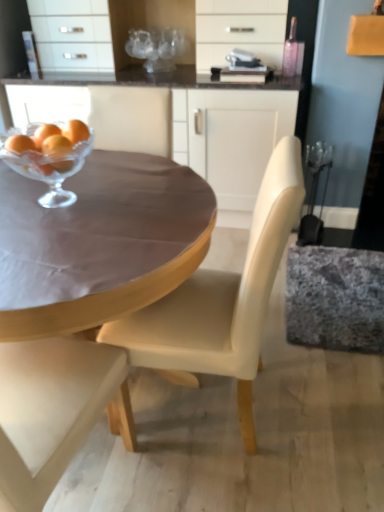
Question: Is matte white cabinet at upper center facing away from translucent glass tangerine at upper left?

Choices:
 (A) no
 (B) yes

Answer: (A)

Question: Considering the relative positions of matte white cabinet at upper center and translucent glass tangerine at upper left in the image provided, is matte white cabinet at upper center to the left of translucent glass tangerine at upper left from the viewer's perspective?

Choices:
 (A) yes
 (B) no

Answer: (B)

Question: Is matte white cabinet at upper center bigger than translucent glass tangerine at upper left?

Choices:
 (A) no
 (B) yes

Answer: (B)

Question: Does matte white cabinet at upper center appear on the right side of translucent glass tangerine at upper left?

Choices:
 (A) no
 (B) yes

Answer: (B)

Question: Is matte white cabinet at upper center not near translucent glass tangerine at upper left?

Choices:
 (A) no
 (B) yes

Answer: (B)

Question: Considering the positions of matte white cabinet at upper center and matte brown table at center in the image, is matte white cabinet at upper center bigger or smaller than matte brown table at center?

Choices:
 (A) small
 (B) big

Answer: (B)

Question: Is matte white cabinet at upper center taller or shorter than matte brown table at center?

Choices:
 (A) tall
 (B) short

Answer: (A)

Question: From the image's perspective, relative to matte brown table at center, is matte white cabinet at upper center above or below?

Choices:
 (A) below
 (B) above

Answer: (B)

Question: From a real-world perspective, is matte white cabinet at upper center positioned above or below matte brown table at center?

Choices:
 (A) below
 (B) above

Answer: (B)

Question: Relative to translucent glass tangerine at upper left, is matte white cabinet at upper center in front or behind?

Choices:
 (A) behind
 (B) front

Answer: (A)

Question: From the image's perspective, is matte white cabinet at upper center located above or below translucent glass tangerine at upper left?

Choices:
 (A) above
 (B) below

Answer: (A)

Question: In terms of width, does matte white cabinet at upper center look wider or thinner when compared to translucent glass tangerine at upper left?

Choices:
 (A) wide
 (B) thin

Answer: (A)

Question: Is point (296, 102) closer or farther from the camera than point (49, 146)?

Choices:
 (A) closer
 (B) farther

Answer: (B)

Question: Considering their positions, is matte white cabinet at upper center located in front of or behind clear glass bowl at center?

Choices:
 (A) front
 (B) behind

Answer: (B)

Question: Is matte white cabinet at upper center bigger or smaller than clear glass bowl at center?

Choices:
 (A) small
 (B) big

Answer: (B)